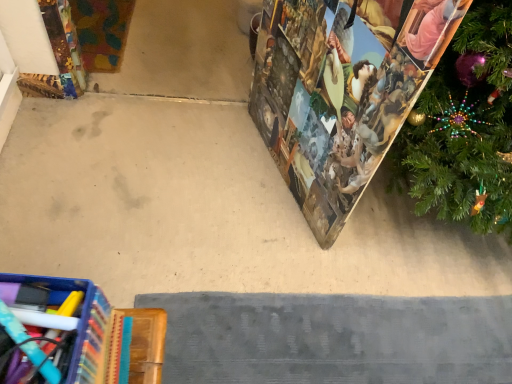
Question: In terms of size, does beige carpet at center appear bigger or smaller than printed paper advent calendar at right?

Choices:
 (A) small
 (B) big

Answer: (A)

Question: Considering the positions of point (79, 221) and point (309, 38), is point (79, 221) closer or farther from the camera than point (309, 38)?

Choices:
 (A) farther
 (B) closer

Answer: (A)

Question: In terms of height, does beige carpet at center look taller or shorter compared to printed paper advent calendar at right?

Choices:
 (A) tall
 (B) short

Answer: (B)

Question: From the image's perspective, relative to beige carpet at center, is printed paper advent calendar at right above or below?

Choices:
 (A) above
 (B) below

Answer: (A)

Question: Is printed paper advent calendar at right taller or shorter than beige carpet at center?

Choices:
 (A) short
 (B) tall

Answer: (B)

Question: Looking at their shapes, would you say printed paper advent calendar at right is wider or thinner than beige carpet at center?

Choices:
 (A) wide
 (B) thin

Answer: (B)

Question: Visually, is printed paper advent calendar at right positioned to the left or to the right of beige carpet at center?

Choices:
 (A) left
 (B) right

Answer: (B)